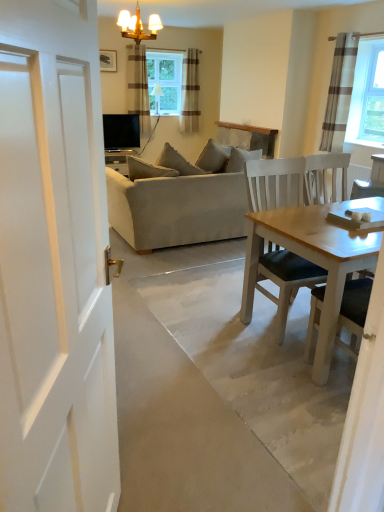
Where is `vacant space to the left of wooden table at right`? vacant space to the left of wooden table at right is located at coordinates (276, 373).